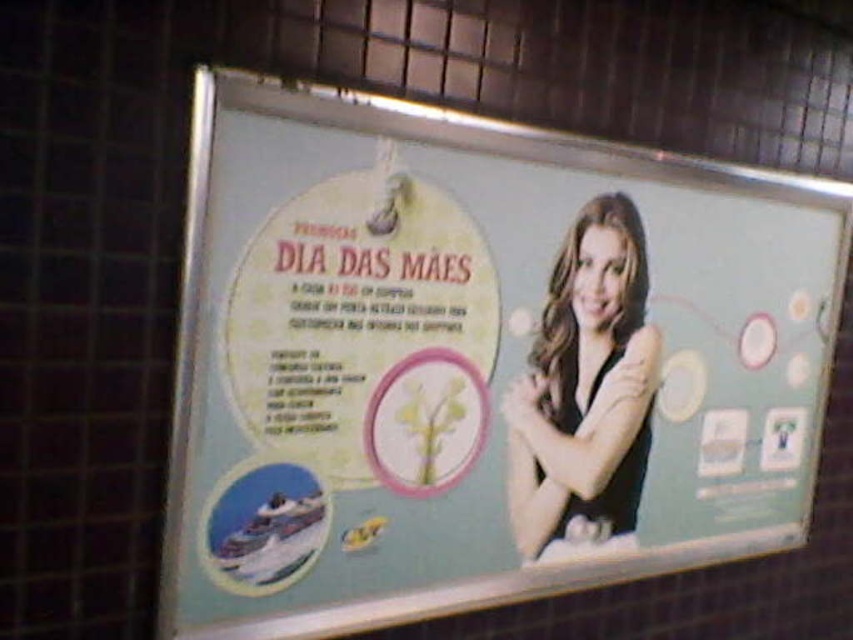
Question: Can you confirm if light blue paper at center is positioned below black matte dress at right?

Choices:
 (A) no
 (B) yes

Answer: (A)

Question: Does light blue paper at center have a larger size compared to black matte dress at right?

Choices:
 (A) yes
 (B) no

Answer: (A)

Question: Does light blue paper at center have a lesser width compared to black matte dress at right?

Choices:
 (A) yes
 (B) no

Answer: (B)

Question: Which point appears closest to the camera in this image?

Choices:
 (A) (206, 134)
 (B) (650, 369)

Answer: (A)

Question: Which point is closer to the camera taking this photo?

Choices:
 (A) (645, 156)
 (B) (606, 451)

Answer: (A)

Question: Which of the following is the farthest from the observer?

Choices:
 (A) light blue paper at center
 (B) black matte dress at right

Answer: (B)